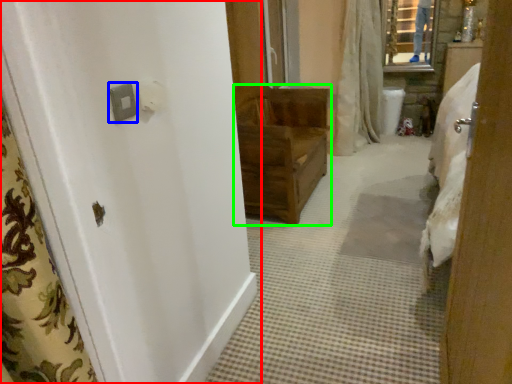
Question: Which object is positioned farthest from door (highlighted by a red box)? Select from light switch (highlighted by a blue box) and furniture (highlighted by a green box).

Choices:
 (A) light switch
 (B) furniture

Answer: (B)